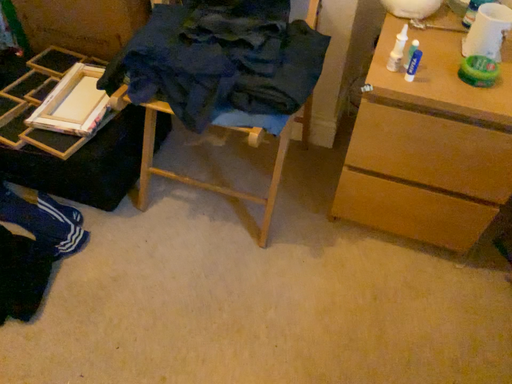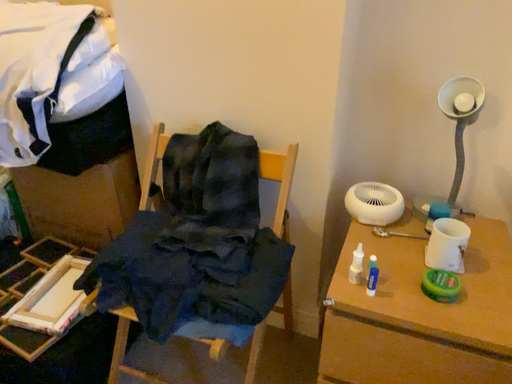
Question: How did the camera likely rotate when shooting the video?

Choices:
 (A) rotated upward
 (B) rotated downward

Answer: (A)